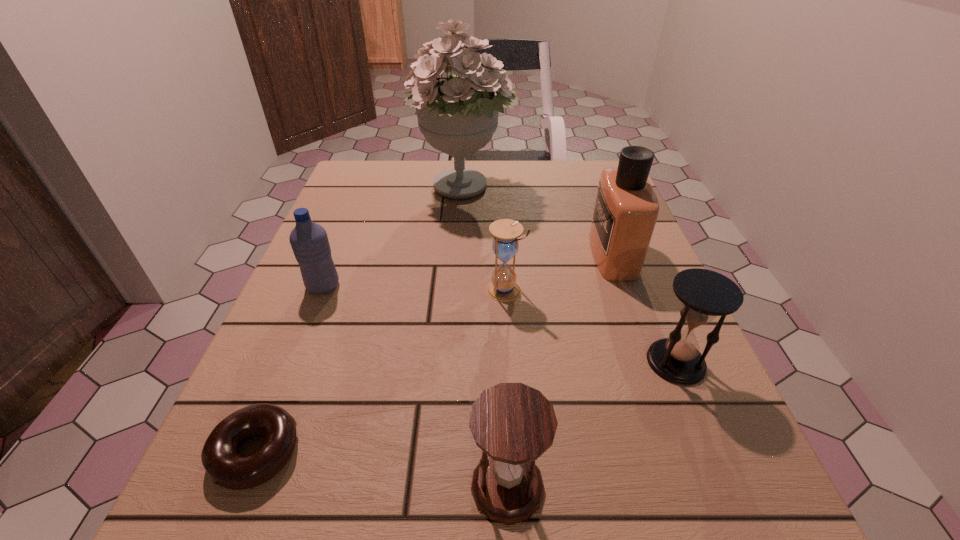
I want to click on vacant space that is in between the second nearest hourglass and the water bottle, so click(x=499, y=324).

You are a GUI agent. You are given a task and a screenshot of the screen. Output one action in this format:
    pyautogui.click(x=<x>, y=<y>)
    Task: Click on the free spot between the doughnut and the farthest hourglass
    The width and height of the screenshot is (960, 540).
    Given the screenshot: What is the action you would take?
    pyautogui.click(x=380, y=370)

The image size is (960, 540). What are the coordinates of `free space between the farthest object and the water bottle` in the screenshot? It's located at (394, 237).

Find the location of `vacant point located between the farthest object and the fifth farthest object`. vacant point located between the farthest object and the fifth farthest object is located at coordinates (570, 275).

At what (x,y) coordinates should I click in order to perform the action: click on object that can be found as the fifth closest to the nearest hourglass. Please return your answer as a coordinate pair (x, y). This screenshot has height=540, width=960. Looking at the image, I should click on (309, 241).

You are a GUI agent. You are given a task and a screenshot of the screen. Output one action in this format:
    pyautogui.click(x=<x>, y=<y>)
    Task: Click on the object that is the sixth closest to the perfume
    
    Given the screenshot: What is the action you would take?
    pyautogui.click(x=226, y=468)

Identify which hourglass is the third closest to the water bottle. Please provide its 2D coordinates. Your answer should be formatted as a tuple, i.e. [(x, y)], where the tuple contains the x and y coordinates of a point satisfying the conditions above.

[(705, 294)]

Identify which hourglass is the second closest to the farthest hourglass. Please provide its 2D coordinates. Your answer should be formatted as a tuple, i.e. [(x, y)], where the tuple contains the x and y coordinates of a point satisfying the conditions above.

[(513, 424)]

The image size is (960, 540). What are the coordinates of `free space that satisfies the following two spatial constraints: 1. on the front side of the nearest hourglass; 2. on the left side of the shortest object` in the screenshot? It's located at (242, 487).

Find the location of a particular element. This screenshot has height=540, width=960. blank space that satisfies the following two spatial constraints: 1. on the back side of the farthest hourglass; 2. on the left side of the doughnut is located at coordinates (321, 290).